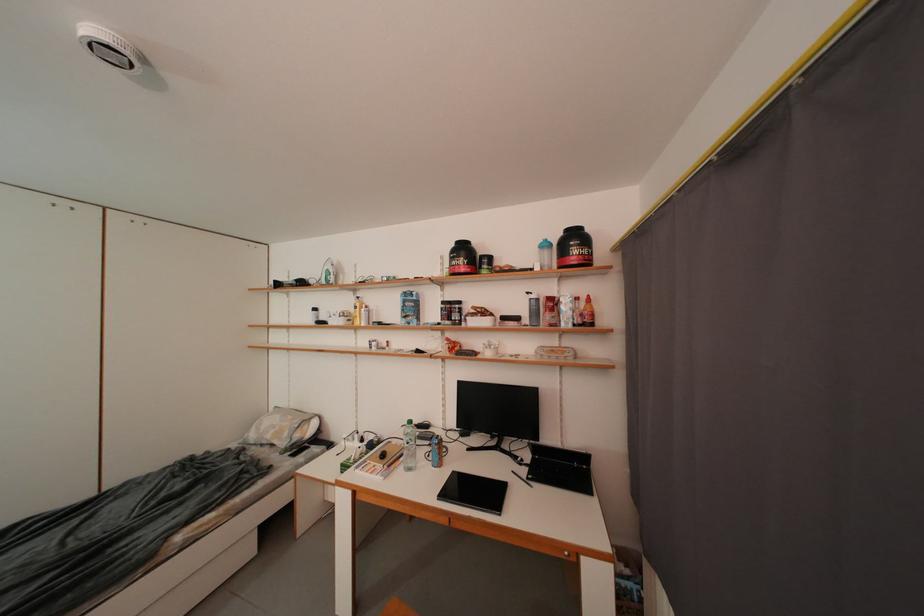
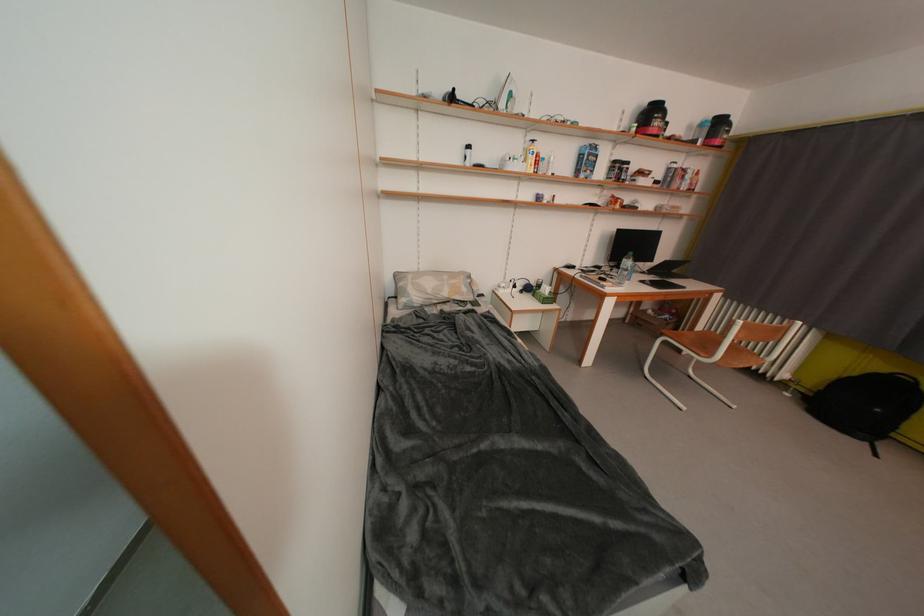
The point at (294,438) is marked in the first image. Where is the corresponding point in the second image?

(471, 293)